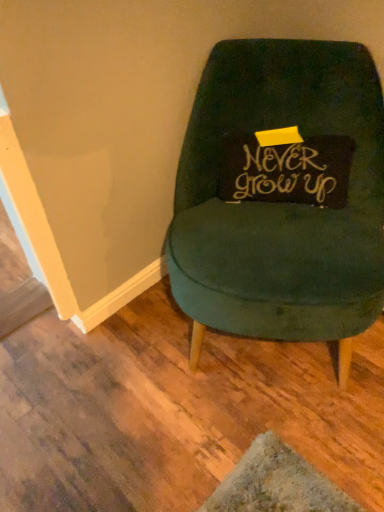
This screenshot has width=384, height=512. I want to click on free space to the left of velvet green chair at center, so click(96, 374).